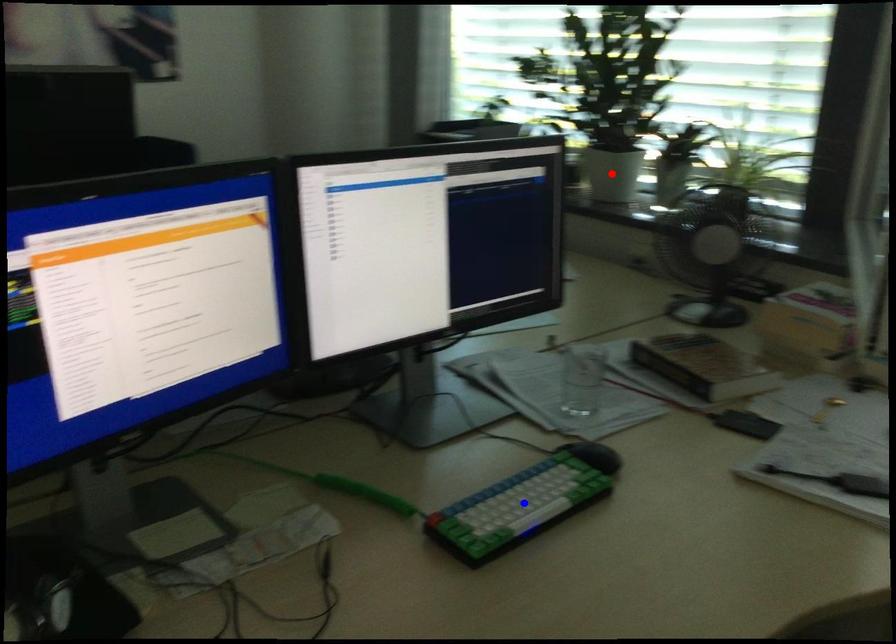
Question: Which of the two points in the image is closer to the camera?

Choices:
 (A) Blue point is closer.
 (B) Red point is closer.

Answer: (A)